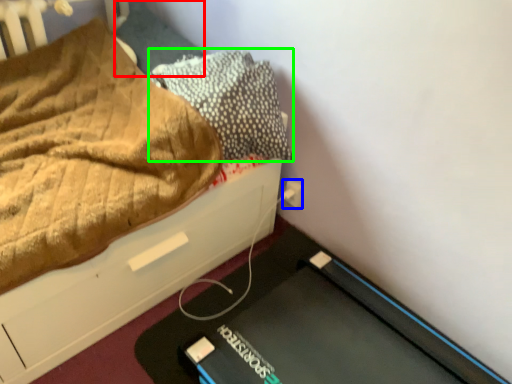
Question: Estimate the real-world distances between objects in this image. Which object is farther from pillow (highlighted by a red box), electric outlet (highlighted by a blue box) or pillow (highlighted by a green box)?

Choices:
 (A) electric outlet
 (B) pillow

Answer: (A)